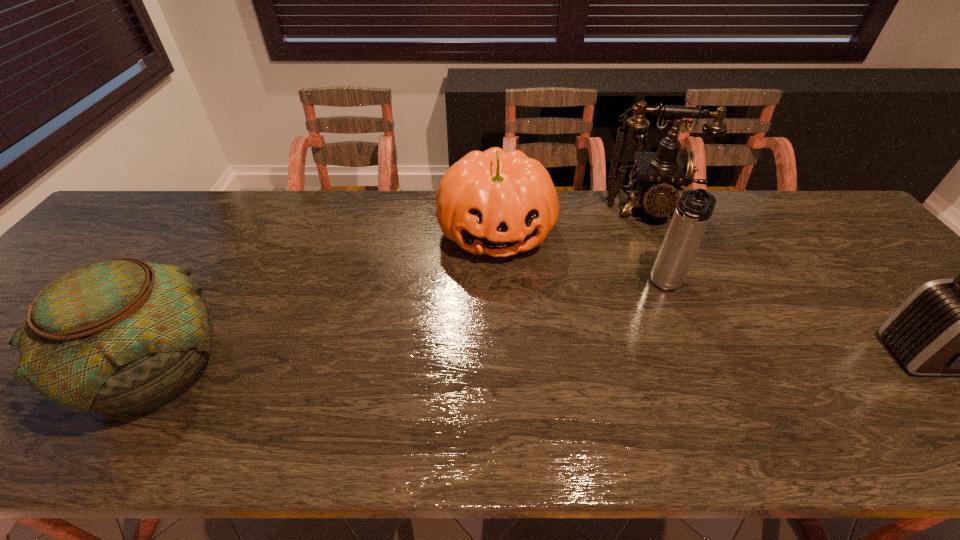
Find the location of a particular element. vacant region that satisfies the following two spatial constraints: 1. on the back side of the pottery; 2. on the right side of the thermos bottle is located at coordinates (208, 285).